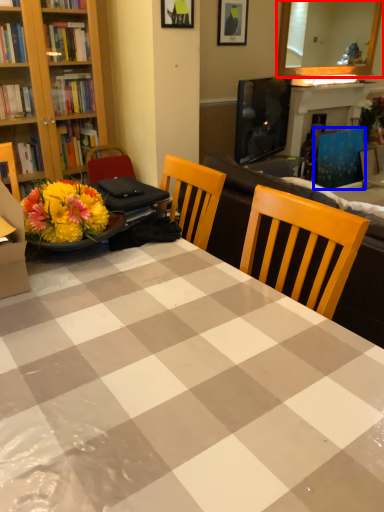
Question: Which object appears farthest to the camera in this image, mirror (highlighted by a red box) or armchair (highlighted by a blue box)?

Choices:
 (A) mirror
 (B) armchair

Answer: (B)